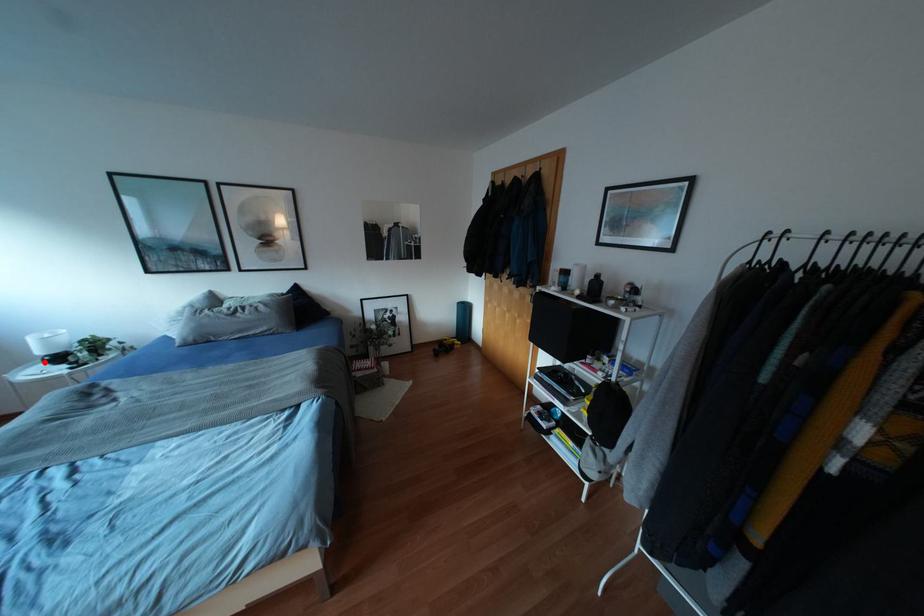
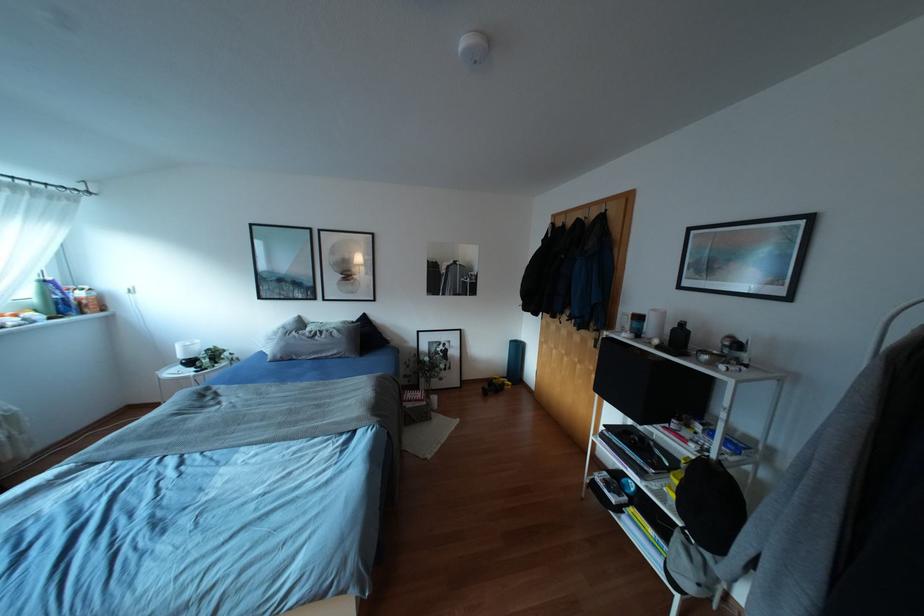
Question: I am providing you with two images of the same scene from different viewpoints. A red point is shown in image1. For the corresponding object point in image2, is it positioned nearer or farther from the camera?

Choices:
 (A) Nearer
 (B) Farther

Answer: (A)